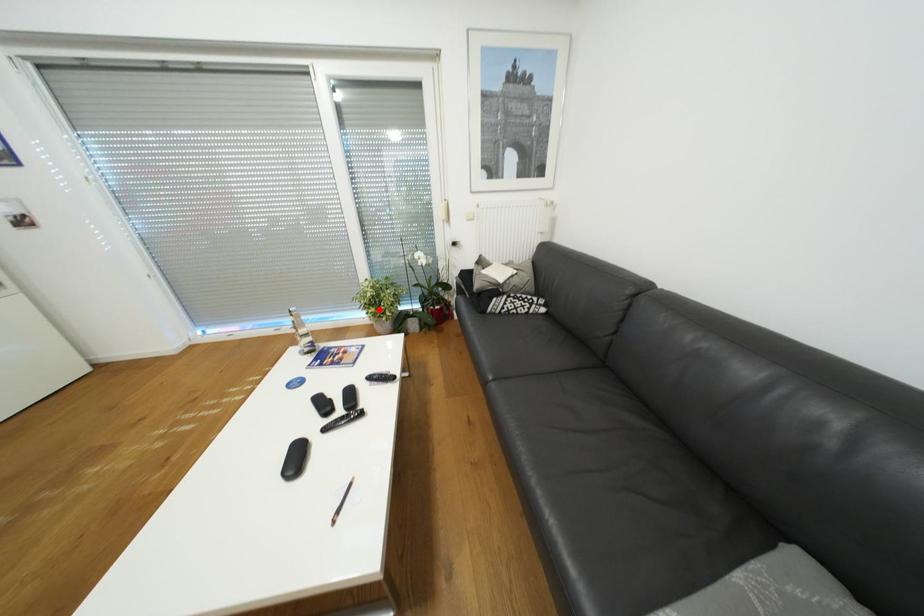
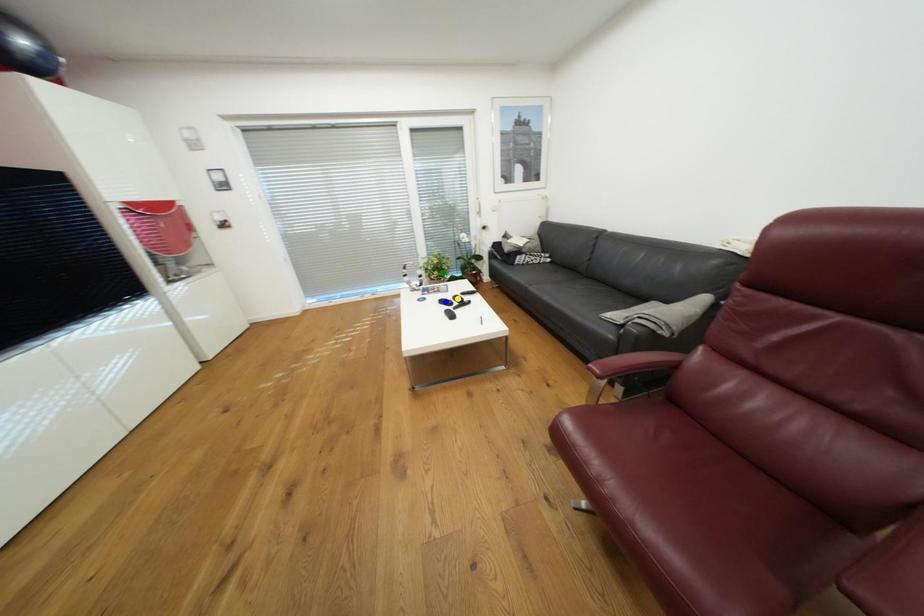
Question: I am providing you with two images of the same scene from different viewpoints. A red point is marked on the first image. You are given multiple points on the second image. Which mark in image 2 goes with the point in image 1?

Choices:
 (A) yellow point
 (B) green point
 (C) blue point

Answer: (B)